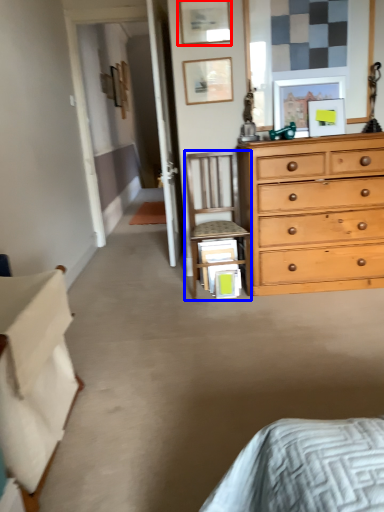
Question: Which of the following is the closest to the observer, picture frame (highlighted by a red box) or chair (highlighted by a blue box)?

Choices:
 (A) picture frame
 (B) chair

Answer: (B)